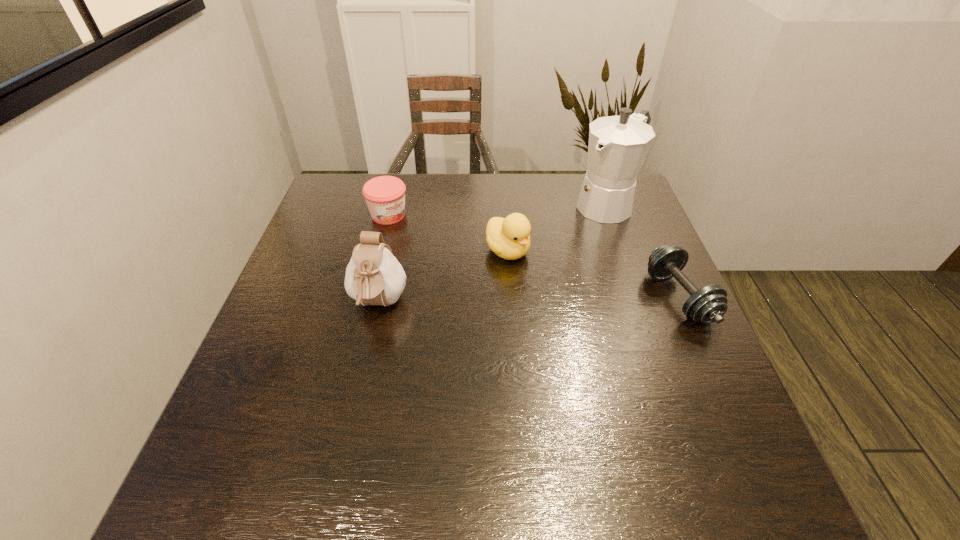
The height and width of the screenshot is (540, 960). Identify the location of free space on the desktop that is between the fourth shortest object and the dumbbell and is positioned on the front label of the jam. (503, 301).

Where is `free space on the desktop that is between the pouch and the dumbbell and is positioned at the spout of the coffeepot`? The height and width of the screenshot is (540, 960). free space on the desktop that is between the pouch and the dumbbell and is positioned at the spout of the coffeepot is located at coordinates (492, 302).

Where is `free space on the desktop that is between the pouch and the dumbbell and is positioned on the front-facing side of the third object from left to right`? The image size is (960, 540). free space on the desktop that is between the pouch and the dumbbell and is positioned on the front-facing side of the third object from left to right is located at coordinates (571, 300).